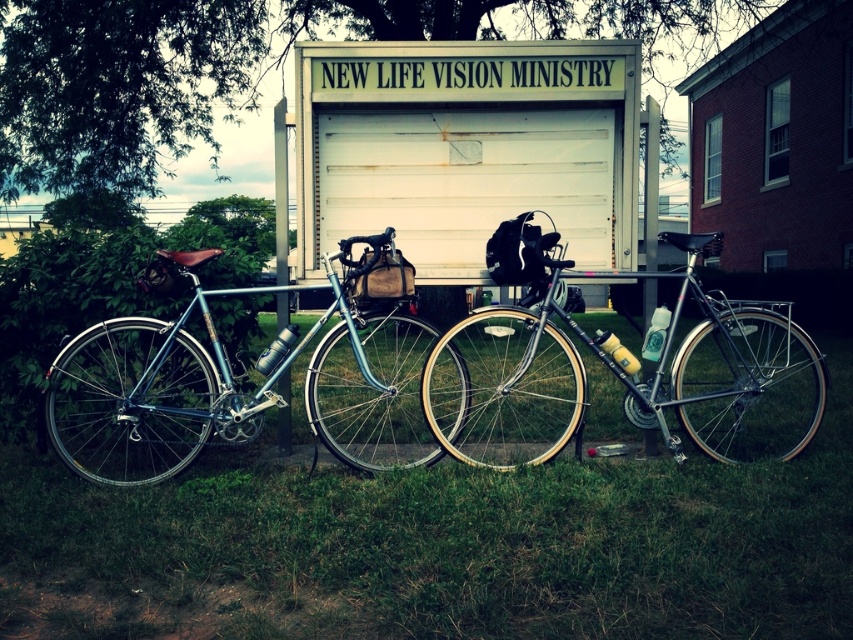
Does shiny blue bicycle at center appear under white matte garage door at center?

Yes.

What do you see at coordinates (233, 387) in the screenshot?
I see `shiny blue bicycle at center` at bounding box center [233, 387].

Locate an element on the screen. shiny blue bicycle at center is located at coordinates (233, 387).

Can you confirm if green grass at lower center is wider than white matte garage door at center?

No, green grass at lower center is not wider than white matte garage door at center.

The height and width of the screenshot is (640, 853). What do you see at coordinates (442, 544) in the screenshot?
I see `green grass at lower center` at bounding box center [442, 544].

Find the location of a particular element. The image size is (853, 640). green grass at lower center is located at coordinates (442, 544).

What do you see at coordinates (442, 544) in the screenshot?
I see `green grass at lower center` at bounding box center [442, 544].

Is green grass at lower center closer to the viewer compared to shiny silver bicycle at center?

Yes, green grass at lower center is in front of shiny silver bicycle at center.

Does point (738, 634) come closer to viewer compared to point (537, 248)?

Yes, point (738, 634) is in front of point (537, 248).

Locate an element on the screen. green grass at lower center is located at coordinates (442, 544).